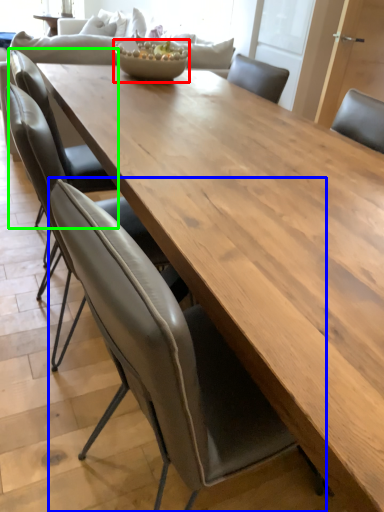
Question: Which object is the farthest from salad bowl (highlighted by a red box)? Choose among these: chair (highlighted by a blue box) or chair (highlighted by a green box).

Choices:
 (A) chair
 (B) chair

Answer: (A)